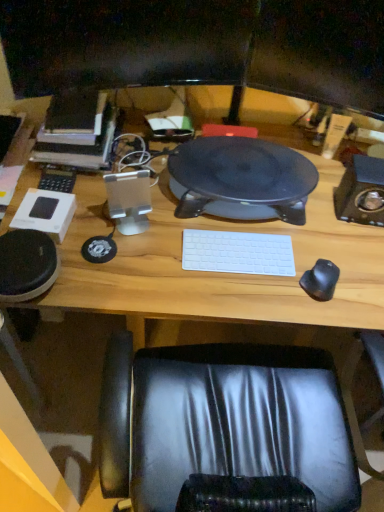
The image size is (384, 512). I want to click on free location to the left of white matte keyboard at center, so click(160, 248).